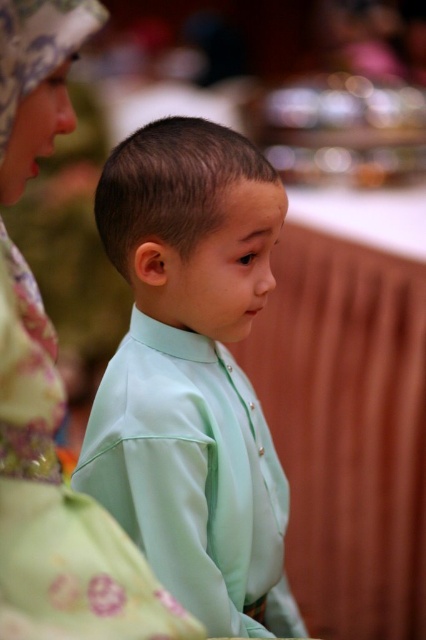
You are a photographer trying to adjust the focus of your camera to capture both the light green satin shirt at center and the matte green shirt at center clearly. Based on the scene description, which shirt should you focus on to ensure both are in focus?

The matte green shirt at center is behind the light green satin shirt at center, so focusing on the light green satin shirt at center would place it in the foreground and the matte green shirt at center in the background. To ensure both are in focus, the photographer should adjust the focus to a point between them or use a smaller aperture for greater depth of field.

You are a photographer adjusting your camera to focus on the light green satin shirt at center. The camera can only focus on objects within a 0.1 radius around the point you choose. If you select the point at coordinates point (192, 374), will the light green satin shirt at center be in focus?

The light green satin shirt at center is represented by point (192, 374), so selecting that point will ensure the shirt is in focus.

You are a tailor who needs to determine which shirt to recommend for a client who prefers a wider torso fit. The client is looking at the light green satin shirt at center and the matte green shirt at center. Based on the image, which shirt would you suggest?

The light green satin shirt at center has a greater width than the matte green shirt at center, so it would be suitable for someone seeking a wider torso fit.